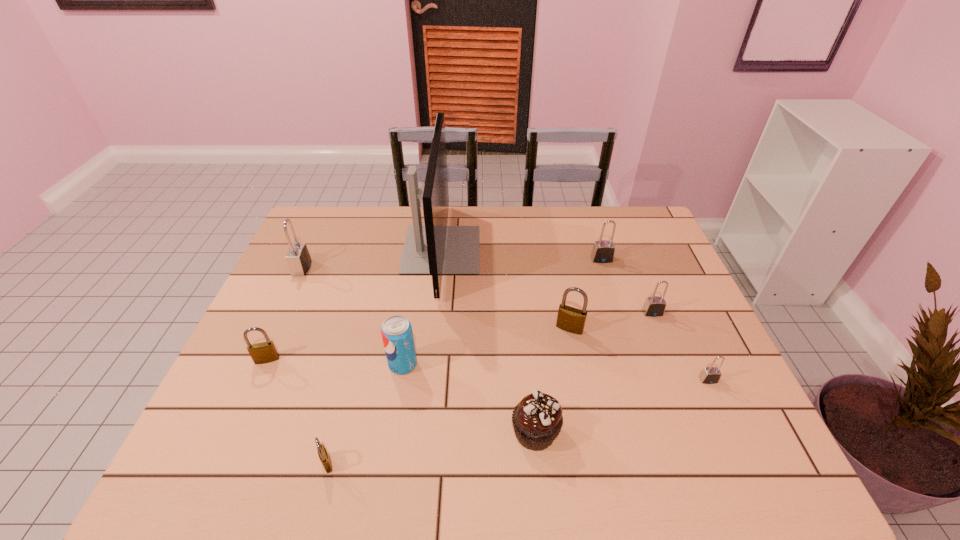
Identify the location of computer monitor. The height and width of the screenshot is (540, 960). coord(435,249).

What are the coordinates of `the biggest gray padlock` in the screenshot? It's located at (298, 257).

This screenshot has height=540, width=960. What are the coordinates of `the leftmost gray padlock` in the screenshot? It's located at (298, 257).

Locate an element on the screen. Image resolution: width=960 pixels, height=540 pixels. the third gray padlock from right to left is located at coordinates (603, 251).

I want to click on the third smallest gray padlock, so click(603, 251).

At what (x,y) coordinates should I click in order to perform the action: click on the sixth nearest object. Please return your answer as a coordinate pair (x, y). This screenshot has height=540, width=960. Looking at the image, I should click on (570, 319).

Where is `the biggest brass padlock`? the biggest brass padlock is located at coordinates pyautogui.click(x=570, y=319).

The image size is (960, 540). Identify the location of soda can. (397, 335).

What are the coordinates of `the second biggest brass padlock` in the screenshot? It's located at (265, 352).

You are a GUI agent. You are given a task and a screenshot of the screen. Output one action in this format:
    pyautogui.click(x=<x>, y=<y>)
    Task: Click on the third nearest padlock
    The image size is (960, 540).
    Given the screenshot: What is the action you would take?
    click(x=265, y=352)